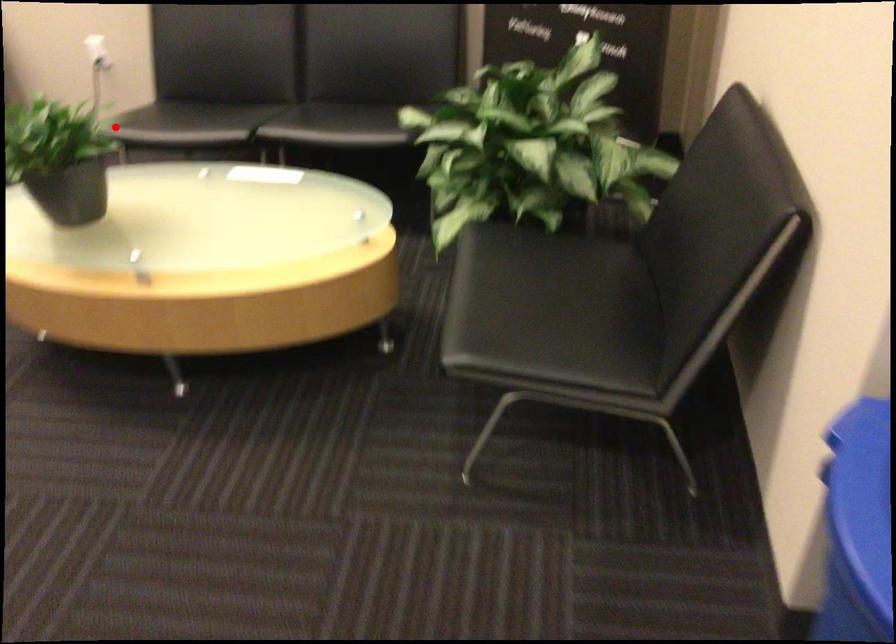
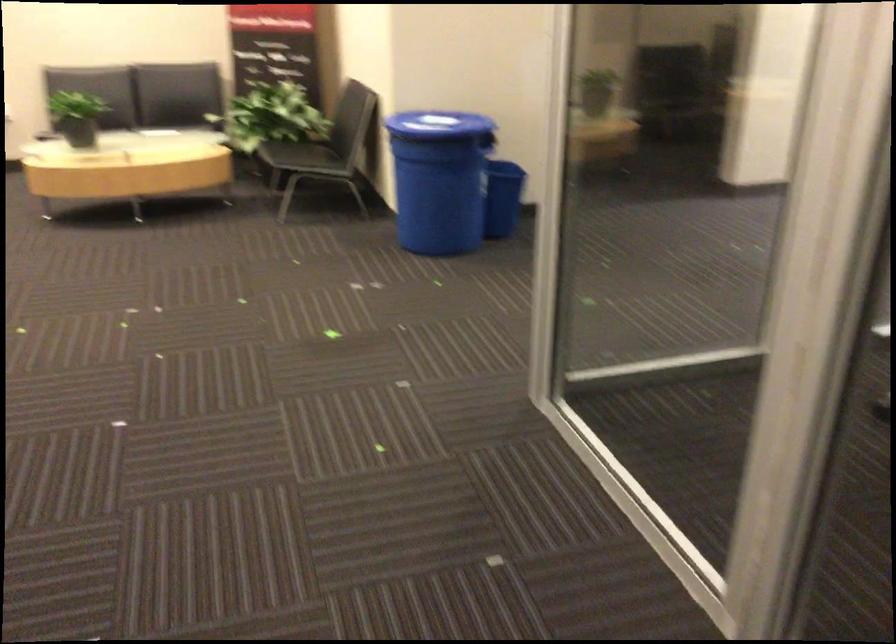
Question: I am providing you with two images of the same scene from different viewpoints. In image1, a red point is highlighted. Considering the same 3D point in image2, which of the following is correct?

Choices:
 (A) It is closer
 (B) It is farther

Answer: (B)